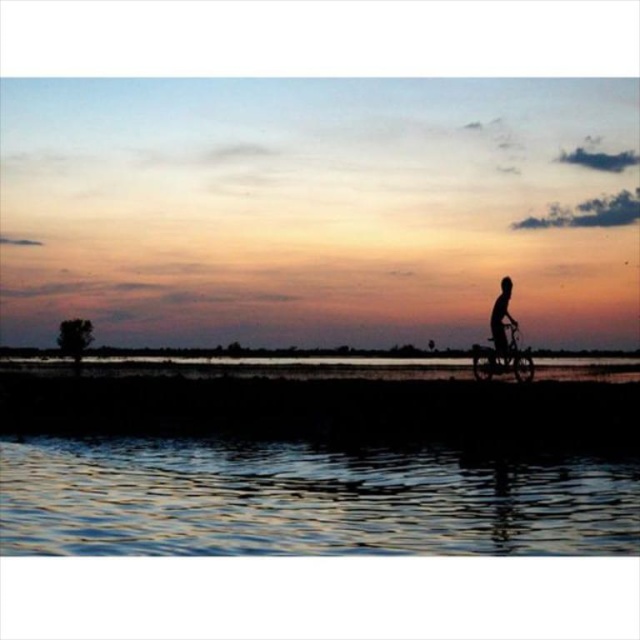
Question: Can you confirm if shiny metallic bicycle at right is wider than silhouette human at right?

Choices:
 (A) no
 (B) yes

Answer: (B)

Question: Which point appears farthest from the camera in this image?

Choices:
 (A) (65, 454)
 (B) (492, 372)
 (C) (513, 321)

Answer: (C)

Question: Does glistening water at lower center have a larger size compared to silhouette human at right?

Choices:
 (A) no
 (B) yes

Answer: (B)

Question: Can you confirm if shiny metallic bicycle at right is positioned below silhouette human at right?

Choices:
 (A) yes
 (B) no

Answer: (A)

Question: Estimate the real-world distances between objects in this image. Which object is farther from the glistening water at lower center?

Choices:
 (A) shiny metallic bicycle at right
 (B) silhouette human at right

Answer: (B)

Question: Which of the following is the closest to the observer?

Choices:
 (A) (x=524, y=371)
 (B) (x=506, y=301)
 (C) (x=538, y=467)

Answer: (C)